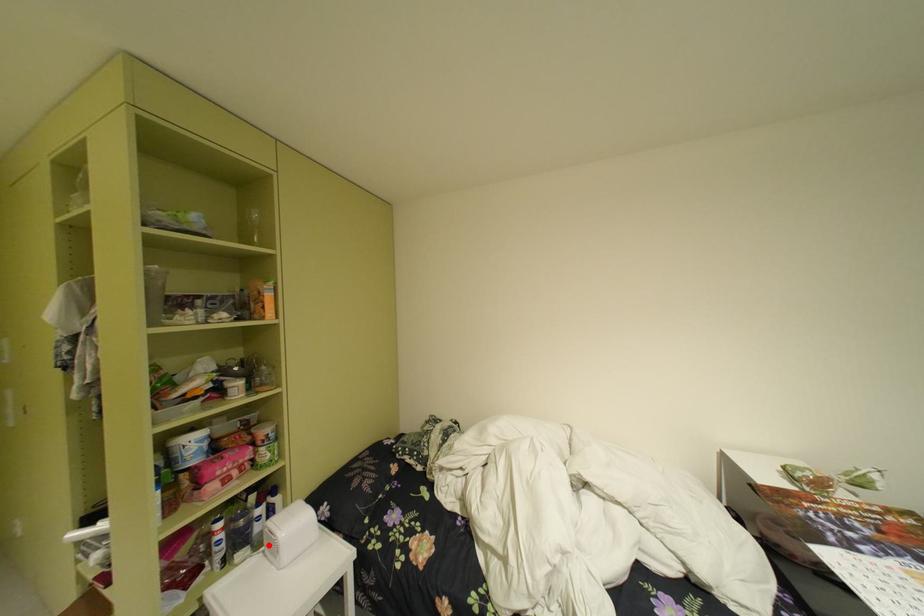
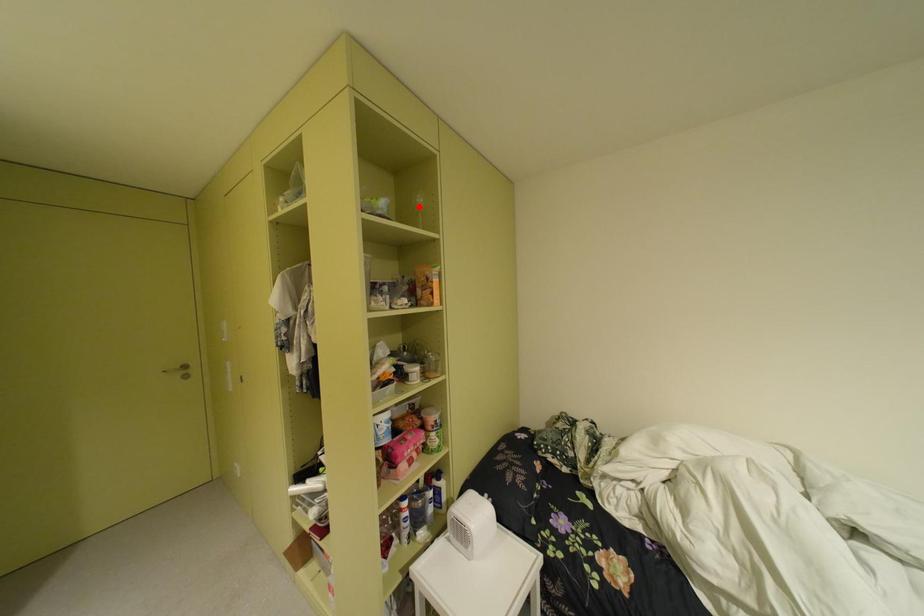
I am providing you with two images of the same scene from different viewpoints. A red point is marked on the first image and another point is marked on the second image. Is the red point in image1 aligned with the point shown in image2?

No